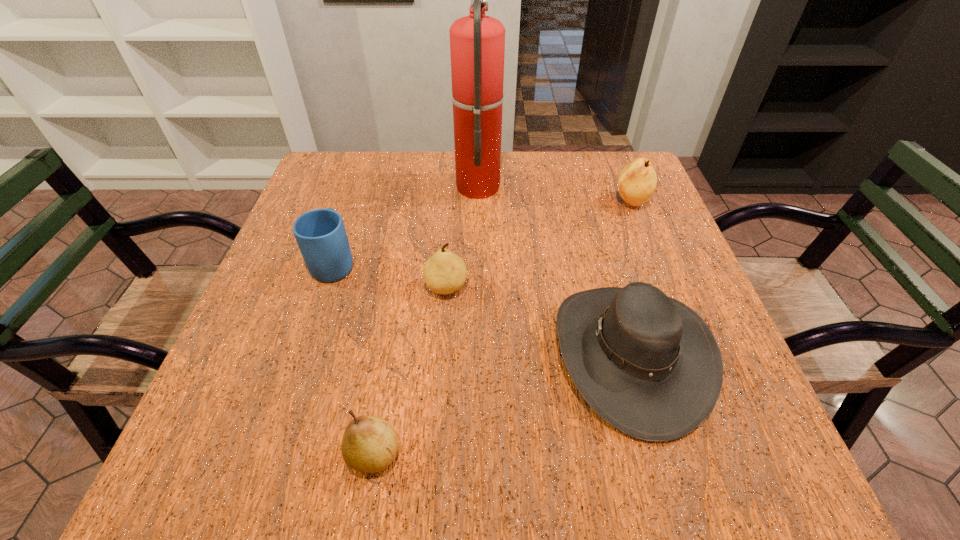
Where is `vacant space situated 0.170m on the side of the mug with the handle`? The image size is (960, 540). vacant space situated 0.170m on the side of the mug with the handle is located at coordinates (356, 198).

Locate an element on the screen. The width and height of the screenshot is (960, 540). vacant space located on the side of the mug with the handle is located at coordinates (355, 200).

Identify the location of free space located 0.280m on the back of the second nearest pear. (453, 195).

Locate an element on the screen. vacant space located 0.380m on the front-facing side of the cowboy hat is located at coordinates (346, 355).

I want to click on vacant region located 0.150m on the front-facing side of the cowboy hat, so click(x=472, y=355).

Where is `free point located on the front-facing side of the cowboy hat`? This screenshot has height=540, width=960. free point located on the front-facing side of the cowboy hat is located at coordinates (456, 355).

Image resolution: width=960 pixels, height=540 pixels. In order to click on free space located 0.180m on the back of the shortest pear in this screenshot , I will do `click(394, 338)`.

This screenshot has width=960, height=540. Identify the location of fire extinguisher that is at the far edge. (477, 42).

You are a GUI agent. You are given a task and a screenshot of the screen. Output one action in this format:
    pyautogui.click(x=<x>, y=<y>)
    Task: Click on the pear located at the far edge
    The width and height of the screenshot is (960, 540).
    Given the screenshot: What is the action you would take?
    pyautogui.click(x=637, y=181)

Identify the location of cowboy hat located at the near edge. Image resolution: width=960 pixels, height=540 pixels. (646, 363).